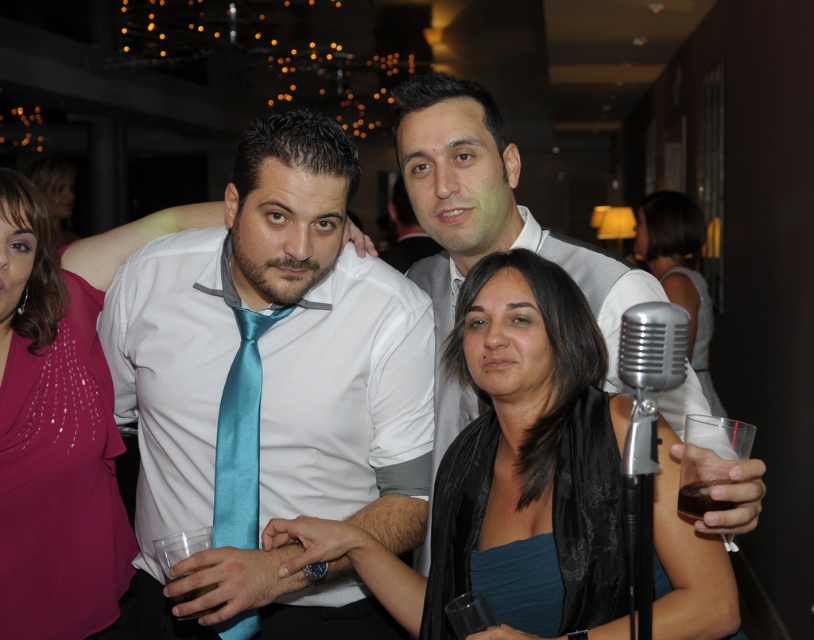
You are a photographer trying to frame a closeup shot of the teal satin scarf at center. Given that the camera has a rectangular viewfinder with aspect ratio 4x3, what is the minimum bounding box coordinates required to fully capture the scarf?

The minimum bounding box coordinates required to fully capture the teal satin scarf at center would be from approximately 0.725 to 0.725 in the x dimension and 0.630 to 0.630 in the y dimension, since the scarf is located precisely at the point (511, 464).